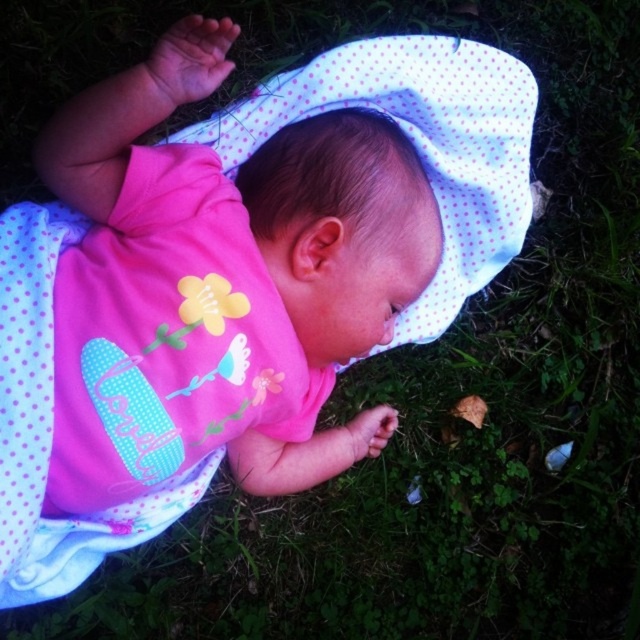
You are a photographer setting up a shoot with a baby wearing a pink matte fabric baby at center and a white dotted fabric at center. Which fabric has a smaller width?

The pink matte fabric baby at center has a lesser width compared to the white dotted fabric at center.